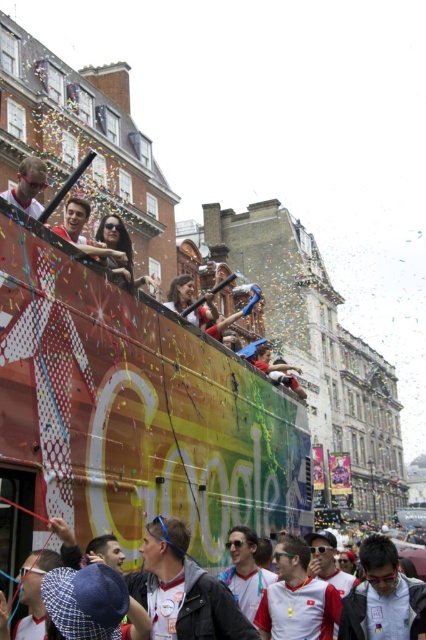
Question: Which of these objects is positioned farthest from the matte white shirt at upper left?

Choices:
 (A) black leather jacket at center
 (B) white glossy hat at upper center
 (C) matte red shirt at center
 (D) matte black sunglasses at center

Answer: (D)

Question: Is matte black sunglasses at center to the left of white fabric shirt at center from the viewer's perspective?

Choices:
 (A) no
 (B) yes

Answer: (A)

Question: Which point is closer to the camera taking this photo?

Choices:
 (A) pos(400,628)
 (B) pos(425,595)
 (C) pos(176,525)
 (D) pos(39,211)

Answer: (C)

Question: Which point appears closest to the camera in this image?

Choices:
 (A) (176, 296)
 (B) (373, 604)

Answer: (B)

Question: Is white glossy hat at upper center wider than matte red shirt at center?

Choices:
 (A) no
 (B) yes

Answer: (B)

Question: Can you confirm if white fabric shirt at center is positioned to the left of matte red shirt at center?

Choices:
 (A) yes
 (B) no

Answer: (B)